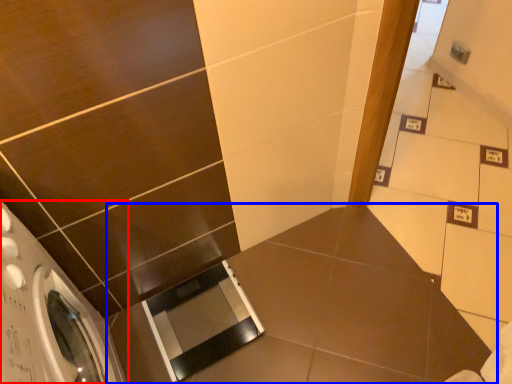
Question: Which object appears closest to the camera in this image, washing machine (highlighted by a red box) or counter top (highlighted by a blue box)?

Choices:
 (A) washing machine
 (B) counter top

Answer: (A)